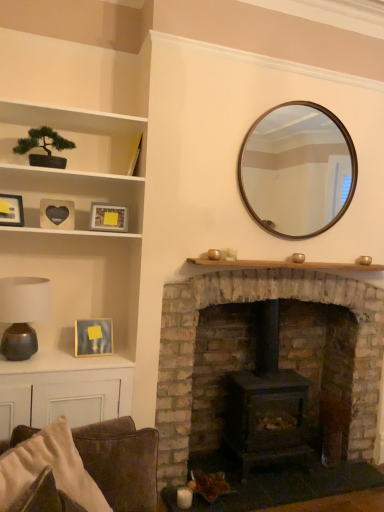
Question: Is brick fireplace at center next to green matte bonsai tree at upper left, the second shelf when ordered from bottom to top, and touching it?

Choices:
 (A) no
 (B) yes

Answer: (A)

Question: Is green matte bonsai tree at upper left, which ranks as the 1th shelf in top-to-bottom order, at the back of brick fireplace at center?

Choices:
 (A) no
 (B) yes

Answer: (A)

Question: Is brick fireplace at center bigger than green matte bonsai tree at upper left, which ranks as the 1th shelf in top-to-bottom order?

Choices:
 (A) no
 (B) yes

Answer: (B)

Question: Is there a large distance between brick fireplace at center and green matte bonsai tree at upper left, the second shelf when ordered from bottom to top?

Choices:
 (A) yes
 (B) no

Answer: (A)

Question: Is the depth of brick fireplace at center greater than that of green matte bonsai tree at upper left, positioned as the first shelf in left-to-right order?

Choices:
 (A) yes
 (B) no

Answer: (A)

Question: From a real-world perspective, relative to green matte bonsai tree at upper left, the second shelf positioned from the right, is wooden picture frame at left, the second picture frame from the right, vertically above or below?

Choices:
 (A) above
 (B) below

Answer: (B)

Question: Considering their positions, is wooden picture frame at left, positioned as the third picture frame in left-to-right order, located in front of or behind green matte bonsai tree at upper left, the second shelf positioned from the right?

Choices:
 (A) behind
 (B) front

Answer: (A)

Question: In the image, is wooden picture frame at left, the second picture frame from the right, on the left side or the right side of green matte bonsai tree at upper left, the second shelf positioned from the right?

Choices:
 (A) left
 (B) right

Answer: (B)

Question: In terms of size, does wooden picture frame at left, the 1th picture frame when ordered from bottom to top, appear bigger or smaller than green matte bonsai tree at upper left, the second shelf positioned from the right?

Choices:
 (A) big
 (B) small

Answer: (B)

Question: Relative to black matte heart at upper left, the fourth picture frame when ordered from bottom to top, is brick fireplace at center in front or behind?

Choices:
 (A) behind
 (B) front

Answer: (B)

Question: Is brick fireplace at center situated inside black matte heart at upper left, the 3th picture frame in the right-to-left sequence, or outside?

Choices:
 (A) outside
 (B) inside

Answer: (A)

Question: Considering the positions of brick fireplace at center and black matte heart at upper left, acting as the first picture frame starting from the top, in the image, is brick fireplace at center wider or thinner than black matte heart at upper left, acting as the first picture frame starting from the top,?

Choices:
 (A) thin
 (B) wide

Answer: (B)

Question: Considering the positions of brick fireplace at center and black matte heart at upper left, acting as the first picture frame starting from the top, in the image, is brick fireplace at center bigger or smaller than black matte heart at upper left, acting as the first picture frame starting from the top,?

Choices:
 (A) big
 (B) small

Answer: (A)

Question: From a real-world perspective, is wooden at center, placed as the 1th shelf when sorted from bottom to top, above or below wooden picture frame at upper left, marked as the third picture frame in a bottom-to-top arrangement?

Choices:
 (A) below
 (B) above

Answer: (A)

Question: Looking at their shapes, would you say wooden at center, which is the 1th shelf in right-to-left order, is wider or thinner than wooden picture frame at upper left, marked as the 4th picture frame in a right-to-left arrangement?

Choices:
 (A) thin
 (B) wide

Answer: (B)